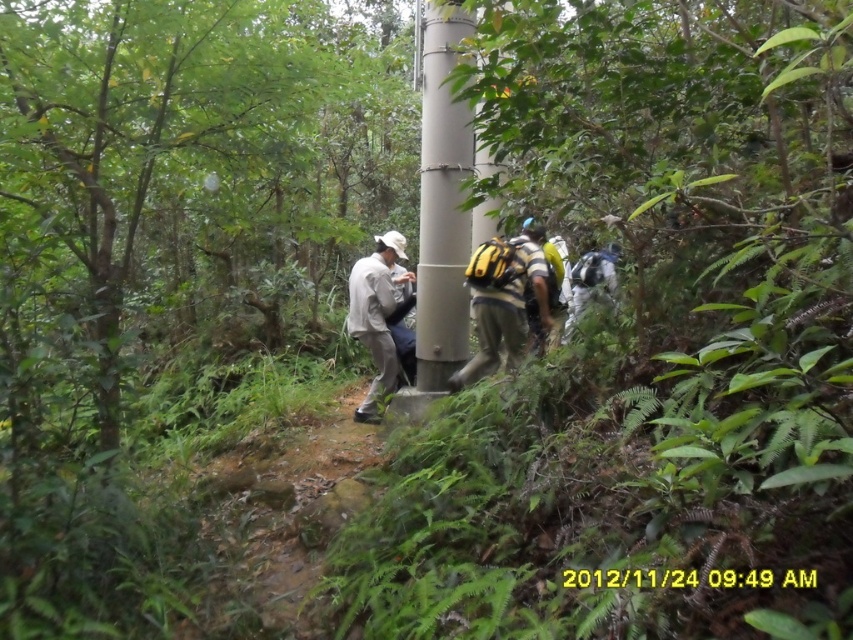
You are a hiker who wants to take a photo of the gray metallic pole at center and the yellow fabric backpack at center. Which object should you focus on first if you want to capture both in the same frame without moving your camera?

The gray metallic pole at center is much taller than the yellow fabric backpack at center, so you should focus on the gray metallic pole at center first to ensure it fits entirely within the frame.